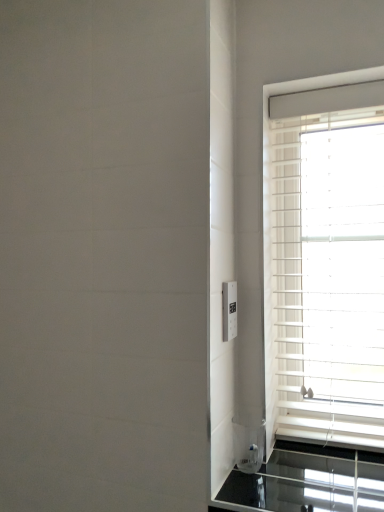
Question: In terms of height, does white plastic blinds at right look taller or shorter compared to white plastic electric outlet at right?

Choices:
 (A) tall
 (B) short

Answer: (A)

Question: Is point (264, 144) closer or farther from the camera than point (231, 325)?

Choices:
 (A) farther
 (B) closer

Answer: (A)

Question: From the image's perspective, is white plastic blinds at right positioned above or below white plastic electric outlet at right?

Choices:
 (A) above
 (B) below

Answer: (A)

Question: In the image, is white plastic electric outlet at right positioned in front of or behind white plastic blinds at right?

Choices:
 (A) front
 (B) behind

Answer: (A)

Question: Looking at the image, does white plastic electric outlet at right seem bigger or smaller compared to white plastic blinds at right?

Choices:
 (A) big
 (B) small

Answer: (B)

Question: Is white plastic electric outlet at right wider or thinner than white plastic blinds at right?

Choices:
 (A) wide
 (B) thin

Answer: (B)

Question: From a real-world perspective, relative to white plastic blinds at right, is white plastic electric outlet at right vertically above or below?

Choices:
 (A) below
 (B) above

Answer: (A)